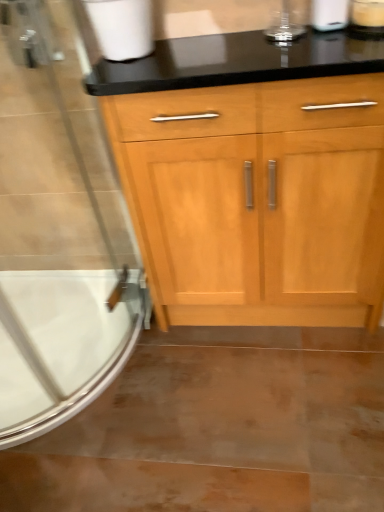
Image resolution: width=384 pixels, height=512 pixels. Find the location of `vacant area located to the right-hand side of clear glass screen door at left`. vacant area located to the right-hand side of clear glass screen door at left is located at coordinates (210, 357).